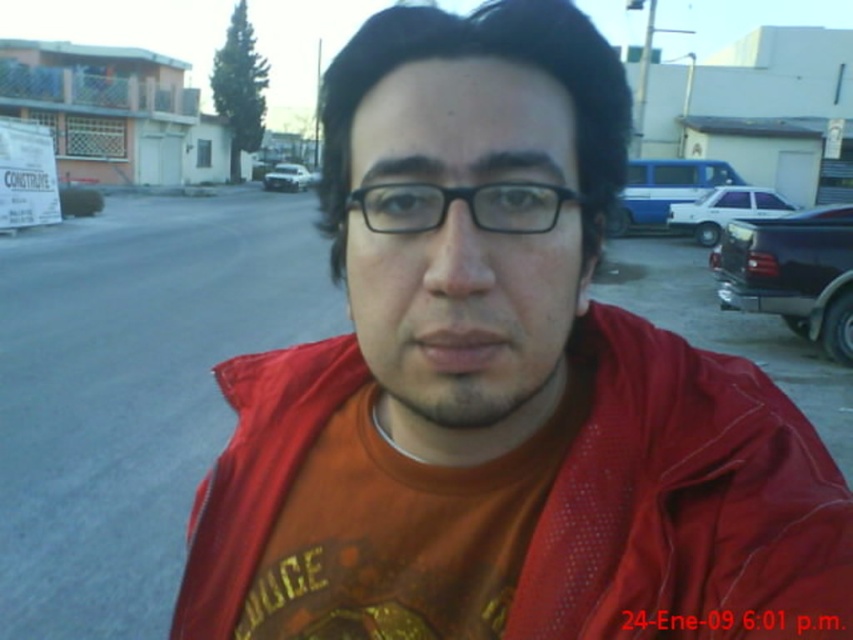
Can you confirm if dark blue metallic truck at right is bigger than blue metallic car at upper right?

No.

Which is behind, point (758, 310) or point (662, 221)?

The point (662, 221) is more distant.

At what (x,y) coordinates should I click in order to perform the action: click on dark blue metallic truck at right. Please return your answer as a coordinate pair (x, y). Looking at the image, I should click on (792, 273).

Is blue metallic car at upper right above white matte car at center?

Actually, blue metallic car at upper right is below white matte car at center.

Is blue metallic car at upper right positioned in front of white matte car at center?

Yes, blue metallic car at upper right is closer to the viewer.

Between point (670, 160) and point (286, 180), which one is positioned behind?

The point (286, 180) is behind.

At what (x,y) coordinates should I click in order to perform the action: click on blue metallic car at upper right. Please return your answer as a coordinate pair (x, y). Looking at the image, I should click on (664, 189).

Which is in front, point (780, 211) or point (280, 179)?

Point (780, 211)

Is white glossy sedan at right above white matte car at center?

Actually, white glossy sedan at right is below white matte car at center.

The width and height of the screenshot is (853, 640). I want to click on white glossy sedan at right, so click(723, 211).